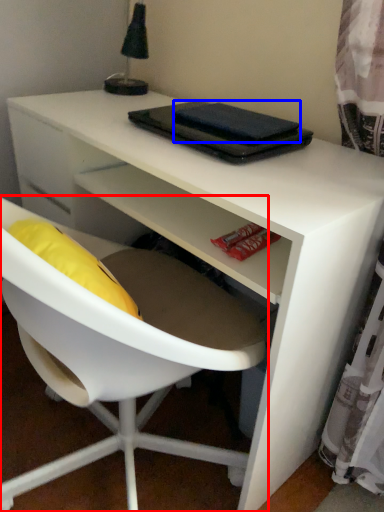
Question: Which object appears closest to the camera in this image, chair (highlighted by a red box) or notebook (highlighted by a blue box)?

Choices:
 (A) chair
 (B) notebook

Answer: (A)